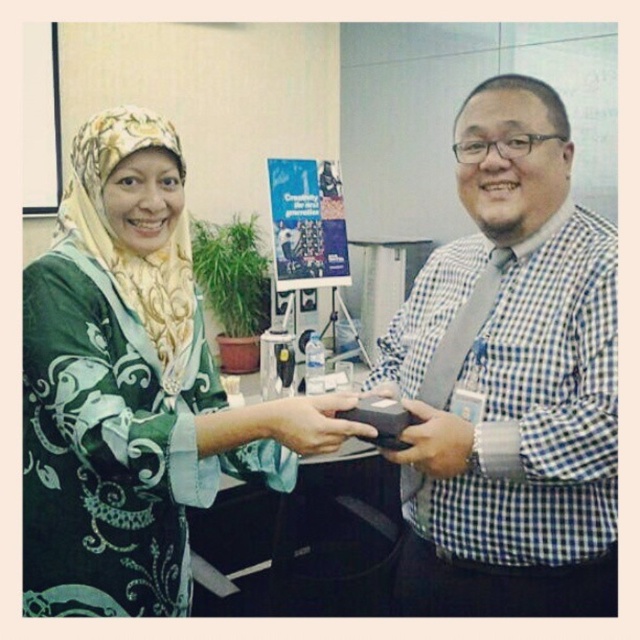
Question: Where is blue checkered shirt at center located in relation to matte black box at center in the image?

Choices:
 (A) right
 (B) left

Answer: (A)

Question: Which object is farther from the camera taking this photo?

Choices:
 (A) green printed dress at center
 (B) matte black box at center
 (C) matte black wallet at center
 (D) blue checkered shirt at center

Answer: (C)

Question: Can you confirm if matte black wallet at center is positioned below matte black box at center?

Choices:
 (A) yes
 (B) no

Answer: (B)

Question: Can you confirm if blue checkered shirt at center is thinner than green printed dress at center?

Choices:
 (A) yes
 (B) no

Answer: (A)

Question: Which point appears farthest from the camera in this image?

Choices:
 (A) (108, 406)
 (B) (314, 438)
 (C) (410, 454)
 (D) (508, 556)

Answer: (D)

Question: Which point appears farthest from the camera in this image?

Choices:
 (A) (321, 394)
 (B) (548, 221)

Answer: (A)